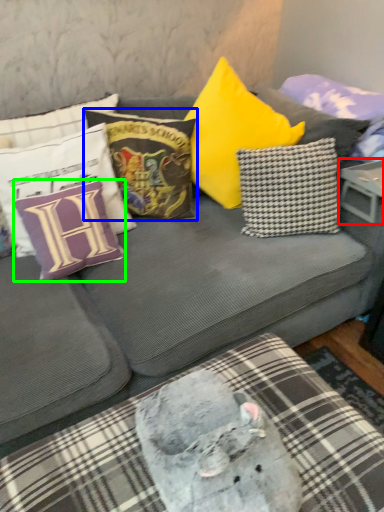
Question: Considering the real-world distances, which object is farthest from table (highlighted by a red box)? pillow (highlighted by a blue box) or pillow (highlighted by a green box)?

Choices:
 (A) pillow
 (B) pillow

Answer: (B)